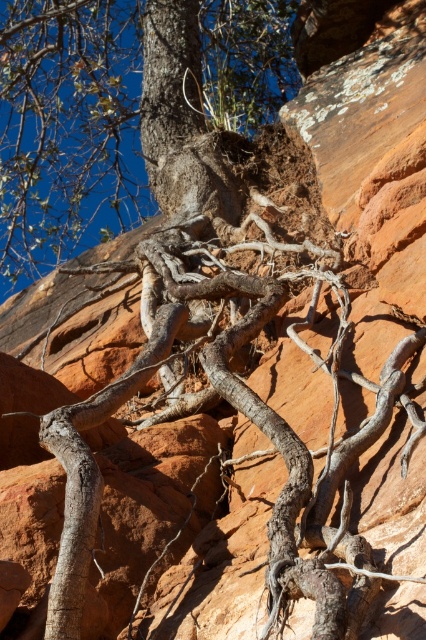
Question: Estimate the real-world distances between objects in this image. Which object is closer to the gray rough bark tree at center?

Choices:
 (A) smooth gray bark at center
 (B) smooth bark tree trunk at upper center

Answer: (B)

Question: Estimate the real-world distances between objects in this image. Which object is closer to the smooth gray bark at center?

Choices:
 (A) smooth bark tree trunk at upper center
 (B) gray rough bark tree at center

Answer: (A)

Question: Can you confirm if gray rough bark tree at center is positioned to the left of smooth bark tree trunk at upper center?

Choices:
 (A) yes
 (B) no

Answer: (A)

Question: Does gray rough bark tree at center lie in front of smooth bark tree trunk at upper center?

Choices:
 (A) yes
 (B) no

Answer: (B)

Question: Estimate the real-world distances between objects in this image. Which object is farther from the smooth gray bark at center?

Choices:
 (A) gray rough bark tree at center
 (B) smooth bark tree trunk at upper center

Answer: (A)

Question: Is gray rough bark tree at center smaller than smooth gray bark at center?

Choices:
 (A) yes
 (B) no

Answer: (B)